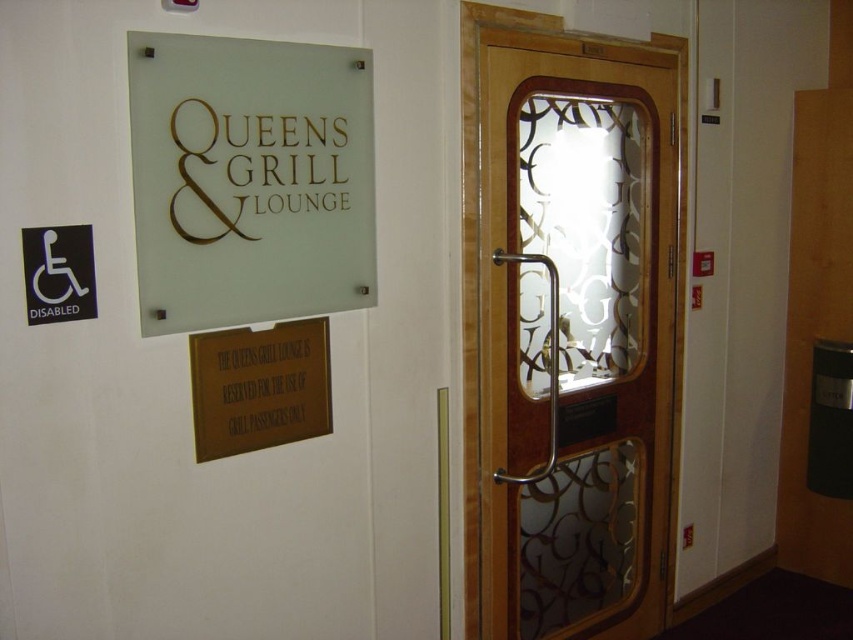
Question: Is frosted glass sign at upper left positioned behind black plastic sign at left?

Choices:
 (A) no
 (B) yes

Answer: (B)

Question: Which of the following is the farthest from the observer?

Choices:
 (A) translucent wood door at right
 (B) gold metallic plaque at lower center
 (C) frosted glass sign at upper left

Answer: (A)

Question: Can you confirm if translucent wood door at right is positioned to the left of gold metallic plaque at lower center?

Choices:
 (A) no
 (B) yes

Answer: (A)

Question: Does translucent wood door at right lie in front of frosted glass sign at upper left?

Choices:
 (A) no
 (B) yes

Answer: (A)

Question: Which of the following is the closest to the observer?

Choices:
 (A) black plastic sign at left
 (B) gold metallic plaque at lower center
 (C) frosted glass sign at upper left
 (D) translucent wood door at right

Answer: (A)

Question: Estimate the real-world distances between objects in this image. Which object is closer to the translucent wood door at right?

Choices:
 (A) frosted glass sign at upper left
 (B) gold metallic plaque at lower center
 (C) black plastic sign at left

Answer: (A)